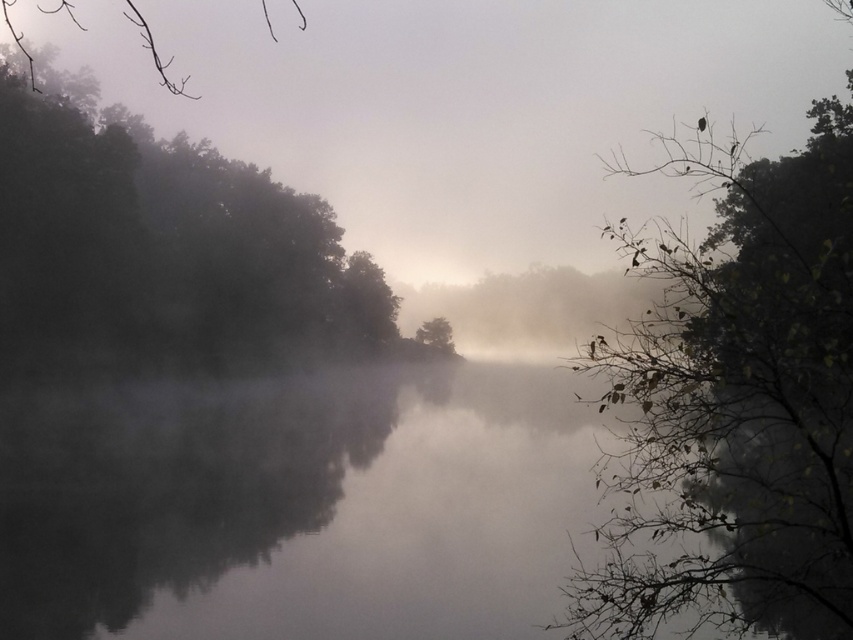
You are standing on the bank of the water and want to walk to the dark green leafy tree at left. Which direction should you move relative to the foggy water at center?

You should move to the left of the foggy water at center to reach the dark green leafy tree at left.

You are a bird flying over the serene misty landscape. You see a point marked at coordinates (x=732, y=406). What object does this point correspond to in the scene?

The point corresponds to green leafy branches at upper right.